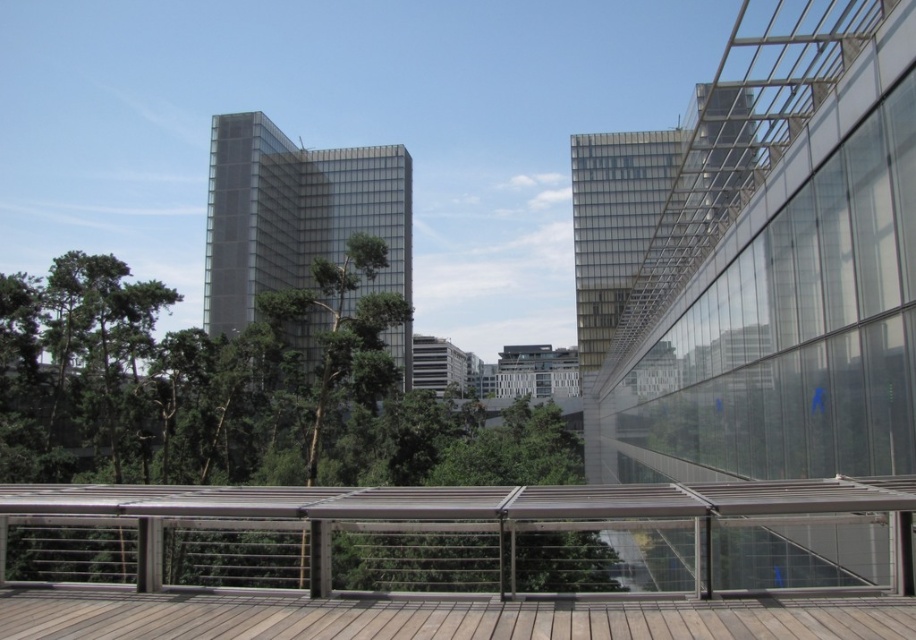
Does wooden deck at center have a lesser width compared to green leafy tree at center?

Indeed, wooden deck at center has a lesser width compared to green leafy tree at center.

Which is above, wooden deck at center or green leafy tree at center?

green leafy tree at center is above.

Find the location of a particular element. This screenshot has width=916, height=640. wooden deck at center is located at coordinates (448, 561).

Can you confirm if green leafy tree at center is thinner than wooden deck at lower center?

In fact, green leafy tree at center might be wider than wooden deck at lower center.

Is point (58, 435) behind point (42, 634)?

Yes, it is.

Who is more forward, (126, 477) or (625, 602)?

Point (625, 602) is more forward.

In order to click on green leafy tree at center in this screenshot , I will do `click(237, 392)`.

Which is more to the left, wooden deck at center or wooden deck at lower center?

wooden deck at center

Looking at this image, how much distance is there between wooden deck at center and wooden deck at lower center?

wooden deck at center is 27.51 feet away from wooden deck at lower center.

Find the location of a particular element. The image size is (916, 640). wooden deck at center is located at coordinates (448, 561).